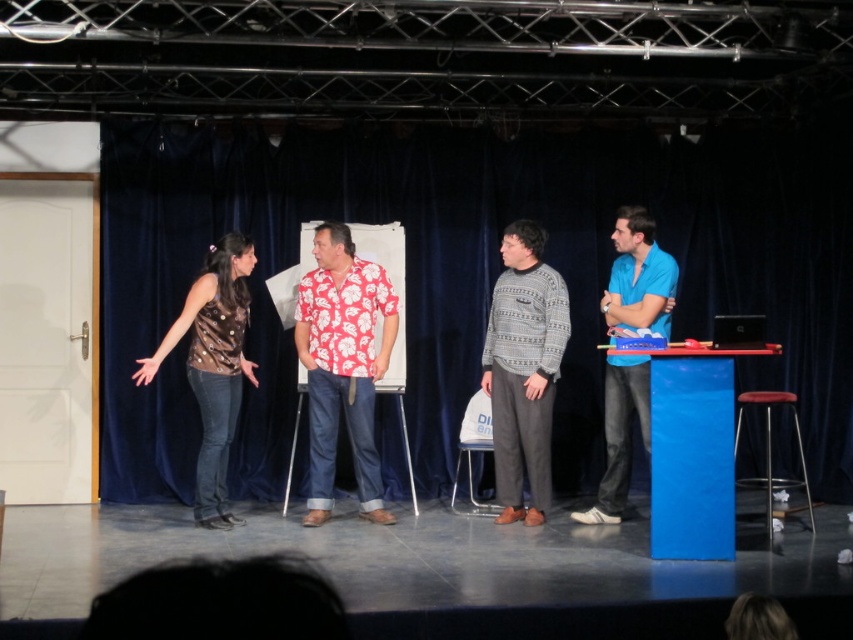
Question: Estimate the real-world distances between objects in this image. Which object is farther from the knitted sweater at center?

Choices:
 (A) blue plastic podium at right
 (B) red fabric stool at lower right

Answer: (B)

Question: Which object appears farthest from the camera in this image?

Choices:
 (A) denim fabric stool at center
 (B) black fabric curtain at upper left
 (C) blue smooth shirt at right
 (D) floral print shirt at center

Answer: (B)

Question: Which object appears farthest from the camera in this image?

Choices:
 (A) blue smooth shirt at right
 (B) denim fabric stool at center
 (C) blue plastic podium at right
 (D) brown shiny tank top at left

Answer: (B)

Question: Does black fabric curtain at upper left come behind floral print shirt at center?

Choices:
 (A) no
 (B) yes

Answer: (B)

Question: Observing the image, what is the correct spatial positioning of knitted sweater at center in reference to denim fabric stool at center?

Choices:
 (A) left
 (B) right

Answer: (B)

Question: Does blue plastic podium at right appear over clear plastic stool at center?

Choices:
 (A) yes
 (B) no

Answer: (A)